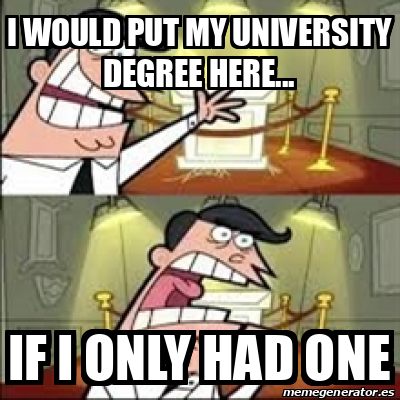
The image size is (400, 400). I want to click on red carpet, so click(48, 393), click(357, 184).